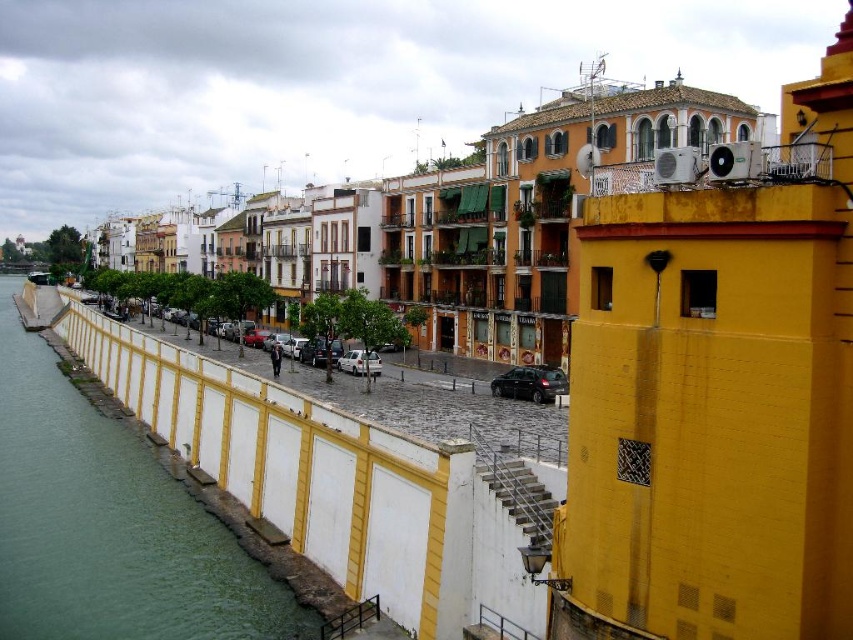
Question: Is green concrete wall at lower left positioned at the back of silver metallic car at center?

Choices:
 (A) yes
 (B) no

Answer: (B)

Question: Which of these objects is positioned farthest from the silver metallic car at center?

Choices:
 (A) green concrete wall at lower left
 (B) shiny black car at center

Answer: (A)

Question: Observing the image, what is the correct spatial positioning of green concrete wall at lower left in reference to silver metallic car at center?

Choices:
 (A) left
 (B) right

Answer: (A)

Question: Can you confirm if green concrete wall at lower left is bigger than silver metallic car at center?

Choices:
 (A) yes
 (B) no

Answer: (A)

Question: Estimate the real-world distances between objects in this image. Which object is farther from the silver metallic car at center?

Choices:
 (A) green concrete wall at lower left
 (B) shiny black car at center

Answer: (A)

Question: Estimate the real-world distances between objects in this image. Which object is farther from the silver metallic car at center?

Choices:
 (A) shiny black car at center
 (B) green concrete wall at lower left

Answer: (B)